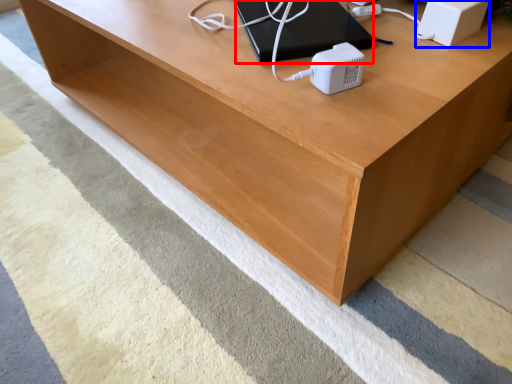
Question: Which of the following is the farthest to the observer, computer (highlighted by a red box) or speaker (highlighted by a blue box)?

Choices:
 (A) computer
 (B) speaker

Answer: (A)